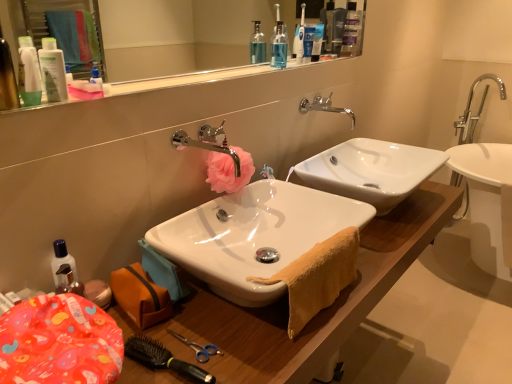
Question: Is white plastic toothpaste tube at upper center, the third toiletry from the bottom, inside the boundaries of pink fabric flower at center, or outside?

Choices:
 (A) inside
 (B) outside

Answer: (B)

Question: In the image, is white plastic toothpaste tube at upper center, positioned as the 1th toiletry in back-to-front order, positioned in front of or behind pink fabric flower at center?

Choices:
 (A) behind
 (B) front

Answer: (A)

Question: Which is farther from the white glossy lotion at upper left, the second toiletry in the right-to-left sequence?

Choices:
 (A) silver metallic faucet at upper center, which is the first tap from back to front
 (B) chrome metallic faucet at center, which is the first tap from front to back
 (C) matte plastic container at lower left
 (D) white glossy sink at center, acting as the 1th sink starting from the back
 (E) clear glass mirror at upper center

Answer: (E)

Question: Which object is the closest to the matte white lotion at upper left, the 3th toiletry viewed from the back?

Choices:
 (A) white plastic toothbrush at upper center
 (B) black plastic brush at lower left, acting as the 1th brush starting from the back
 (C) white glossy sink at center, acting as the 1th sink starting from the back
 (D) wooden cabinet at lower left
 (E) clear glass mirror at upper center

Answer: (B)